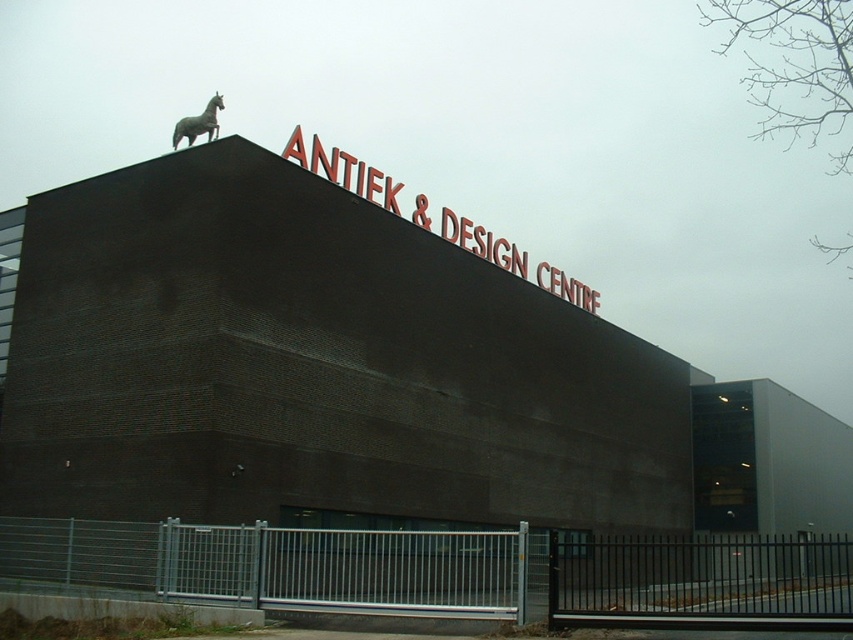
Can you confirm if metallic silver fence at lower center is wider than metallic horse at upper center?

Indeed, metallic silver fence at lower center has a greater width compared to metallic horse at upper center.

Which of these two, metallic silver fence at lower center or metallic horse at upper center, stands taller?

With more height is metallic silver fence at lower center.

Does point (492, 548) come behind point (173, 148)?

No, it is not.

You are a GUI agent. You are given a task and a screenshot of the screen. Output one action in this format:
    pyautogui.click(x=<x>, y=<y>)
    Task: Click on the metallic silver fence at lower center
    The height and width of the screenshot is (640, 853).
    Given the screenshot: What is the action you would take?
    454,570

Can you confirm if red metallic sign at upper center is shorter than metallic horse at upper center?

No.

Is red metallic sign at upper center behind metallic horse at upper center?

No, red metallic sign at upper center is closer to the viewer.

Where is `red metallic sign at upper center`? The width and height of the screenshot is (853, 640). red metallic sign at upper center is located at coordinates [343, 170].

What do you see at coordinates (454, 570) in the screenshot?
I see `metallic silver fence at lower center` at bounding box center [454, 570].

Which is in front, point (653, 625) or point (451, 230)?

Positioned in front is point (653, 625).

In the scene shown: Who is more distant from viewer, (838, 573) or (457, 232)?

Point (838, 573)

In order to click on metallic silver fence at lower center in this screenshot , I will do `click(454, 570)`.